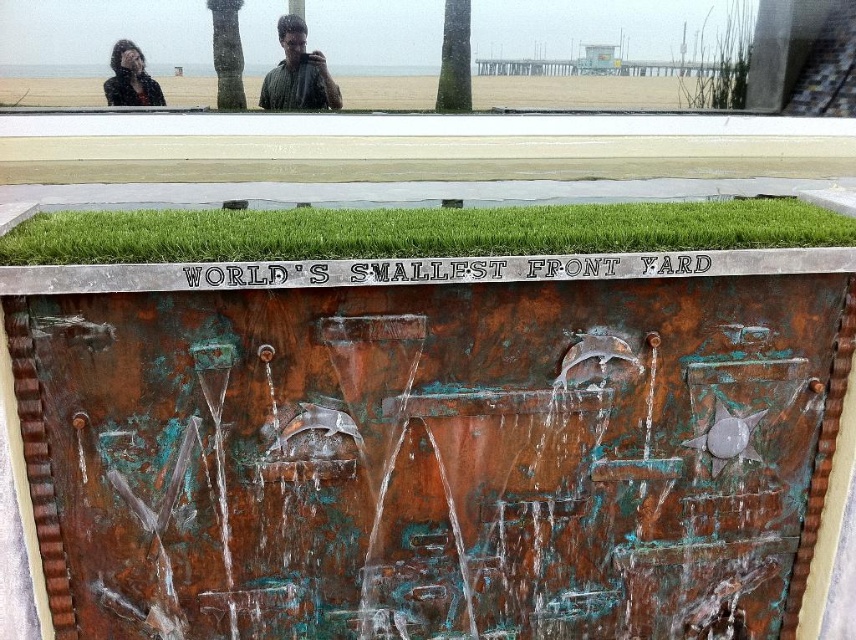
Question: Which object is farther from the camera taking this photo?

Choices:
 (A) green grass at upper center
 (B) rusty copper water at center
 (C) green patina metal palm tree at center

Answer: (A)

Question: Which point is farther to the camera?

Choices:
 (A) green matte shirt at upper center
 (B) rusty metal sign at center
 (C) green artificial turf at center

Answer: (A)

Question: Which point is closer to the camera?

Choices:
 (A) (575, 212)
 (B) (595, 84)
 (C) (284, 54)
 (D) (720, 266)

Answer: (D)

Question: Considering the relative positions of green grass at upper center and dark brown hair at upper left in the image provided, where is green grass at upper center located with respect to dark brown hair at upper left?

Choices:
 (A) left
 (B) right

Answer: (B)

Question: Is green artificial turf at center above dark brown hair at upper left?

Choices:
 (A) no
 (B) yes

Answer: (A)

Question: Does green artificial turf at center appear under green textured palm tree at upper center?

Choices:
 (A) yes
 (B) no

Answer: (A)